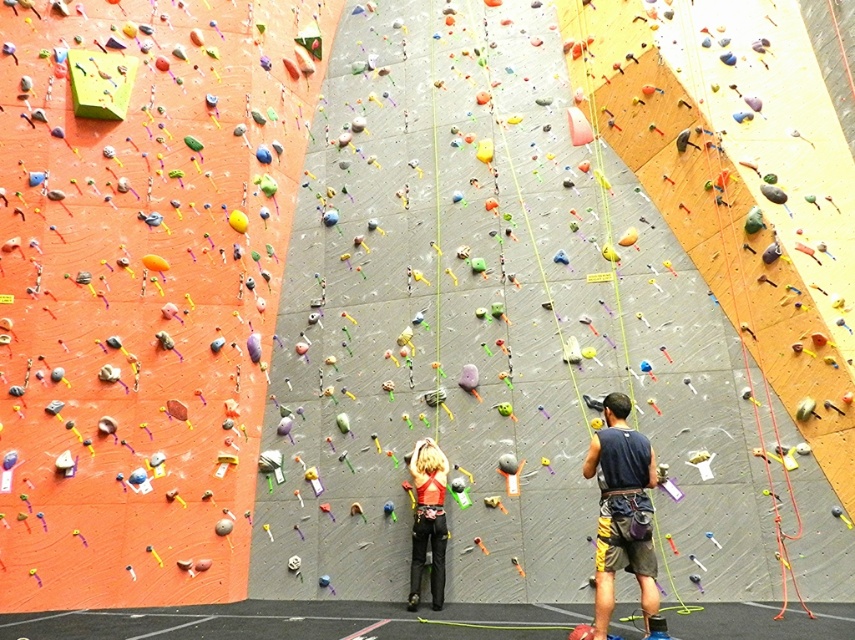
Measure the distance from dark blue tank top at center to matte red harness at center.

dark blue tank top at center is 3.24 meters from matte red harness at center.

Image resolution: width=855 pixels, height=640 pixels. Describe the element at coordinates (622, 509) in the screenshot. I see `dark blue tank top at center` at that location.

What are the coordinates of `dark blue tank top at center` in the screenshot? It's located at pyautogui.click(x=622, y=509).